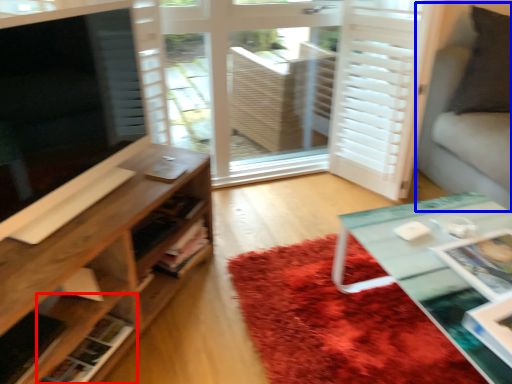
Question: Which object appears closest to the camera in this image, shelf (highlighted by a red box) or couch (highlighted by a blue box)?

Choices:
 (A) shelf
 (B) couch

Answer: (A)